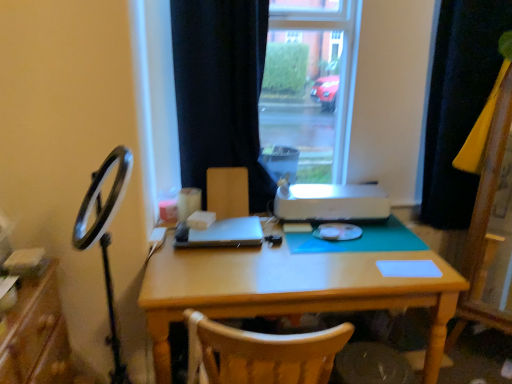
Question: Considering the relative sizes of wooden desk at center and black fabric curtain at center, which is the first curtain from left to right, in the image provided, is wooden desk at center bigger than black fabric curtain at center, which is the first curtain from left to right,?

Choices:
 (A) no
 (B) yes

Answer: (B)

Question: Does wooden desk at center appear on the right side of black fabric curtain at center, which is the 2th curtain in right-to-left order?

Choices:
 (A) no
 (B) yes

Answer: (B)

Question: Can you confirm if wooden desk at center is smaller than black fabric curtain at center, which is the 2th curtain in right-to-left order?

Choices:
 (A) yes
 (B) no

Answer: (B)

Question: Could you tell me if wooden desk at center is turned towards black fabric curtain at center, which is the 2th curtain in right-to-left order?

Choices:
 (A) no
 (B) yes

Answer: (A)

Question: Is wooden desk at center taller than black fabric curtain at center, which is the 2th curtain in right-to-left order?

Choices:
 (A) no
 (B) yes

Answer: (A)

Question: Considering the positions of black fabric curtain at center, which is the first curtain from left to right, and satin black laptop at center in the image, is black fabric curtain at center, which is the first curtain from left to right, wider or thinner than satin black laptop at center?

Choices:
 (A) thin
 (B) wide

Answer: (B)

Question: Considering their positions, is black fabric curtain at center, which is the first curtain from left to right, located in front of or behind satin black laptop at center?

Choices:
 (A) behind
 (B) front

Answer: (B)

Question: Considering the positions of point (245, 72) and point (210, 241), is point (245, 72) closer or farther from the camera than point (210, 241)?

Choices:
 (A) farther
 (B) closer

Answer: (A)

Question: From the image's perspective, is black fabric curtain at center, which is the first curtain from left to right, located above or below satin black laptop at center?

Choices:
 (A) above
 (B) below

Answer: (A)

Question: From a real-world perspective, relative to wooden chair at center, is black fabric curtain at right, arranged as the first curtain when viewed from the right, vertically above or below?

Choices:
 (A) below
 (B) above

Answer: (B)

Question: From the image's perspective, is black fabric curtain at right, arranged as the first curtain when viewed from the right, located above or below wooden chair at center?

Choices:
 (A) below
 (B) above

Answer: (B)

Question: In the image, is black fabric curtain at right, arranged as the first curtain when viewed from the right, positioned in front of or behind wooden chair at center?

Choices:
 (A) behind
 (B) front

Answer: (B)

Question: Based on their positions, is black fabric curtain at right, arranged as the first curtain when viewed from the right, located to the left or right of wooden chair at center?

Choices:
 (A) right
 (B) left

Answer: (A)

Question: From a real-world perspective, is white plastic printer at center physically located above or below black fabric curtain at right, arranged as the first curtain when viewed from the right?

Choices:
 (A) above
 (B) below

Answer: (B)

Question: From the image's perspective, is white plastic printer at center located above or below black fabric curtain at right, arranged as the second curtain when viewed from the left?

Choices:
 (A) above
 (B) below

Answer: (B)